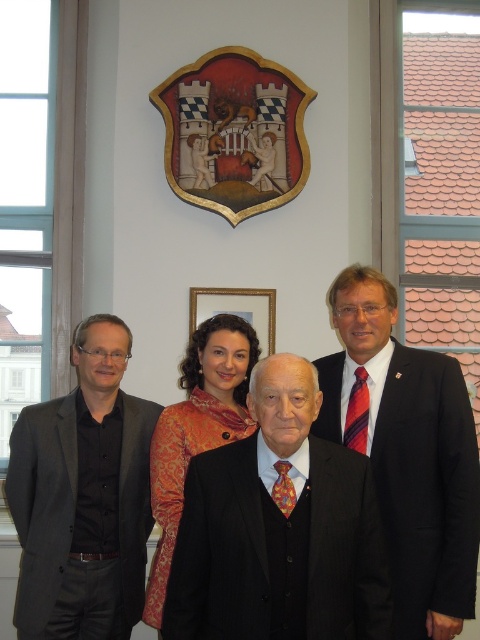
Question: Does matte black suit at right come in front of wooden framed portrait at center?

Choices:
 (A) yes
 (B) no

Answer: (A)

Question: Which point is closer to the camera?

Choices:
 (A) matte black suit at right
 (B) orange brocade dress at center

Answer: (A)

Question: In this image, where is orange brocade dress at center located relative to wooden framed portrait at center?

Choices:
 (A) above
 (B) below

Answer: (B)

Question: Which is farther from the matte black suit at right?

Choices:
 (A) black pinstripe suit at center
 (B) dark gray suit at left
 (C) orange brocade dress at center

Answer: (B)

Question: Which point appears closest to the camera in this image?

Choices:
 (A) (454, 433)
 (B) (83, 556)
 (C) (186, 449)
 (D) (225, 490)

Answer: (D)

Question: Does matte black suit at right appear on the right side of orange brocade dress at center?

Choices:
 (A) yes
 (B) no

Answer: (A)